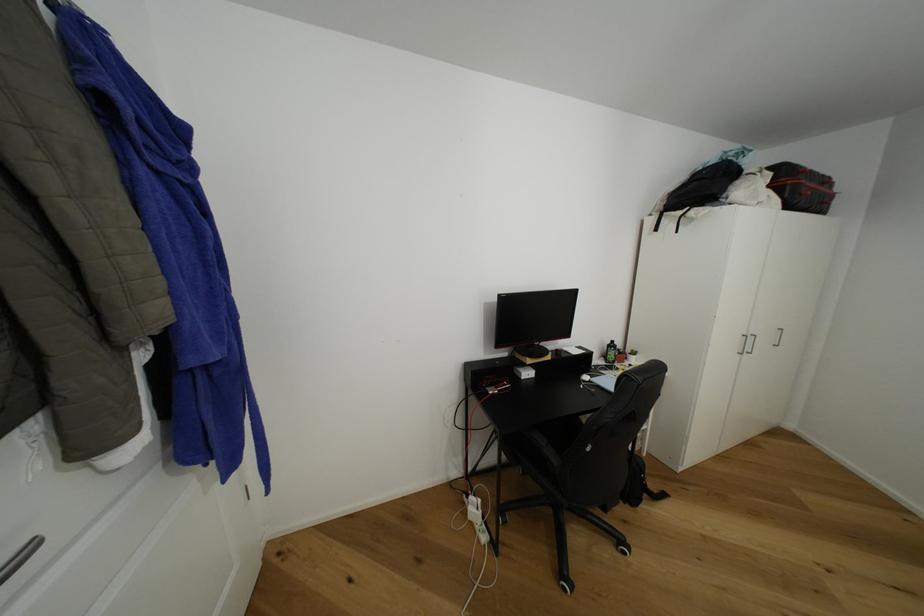
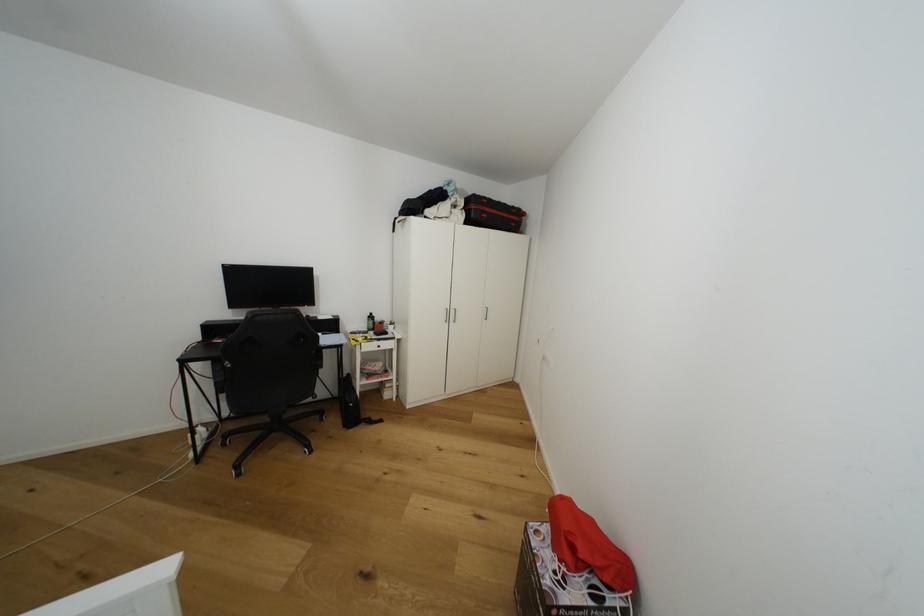
The images are taken continuously from a first-person perspective. In which direction are you moving?

The cameraman moved toward right, backward.